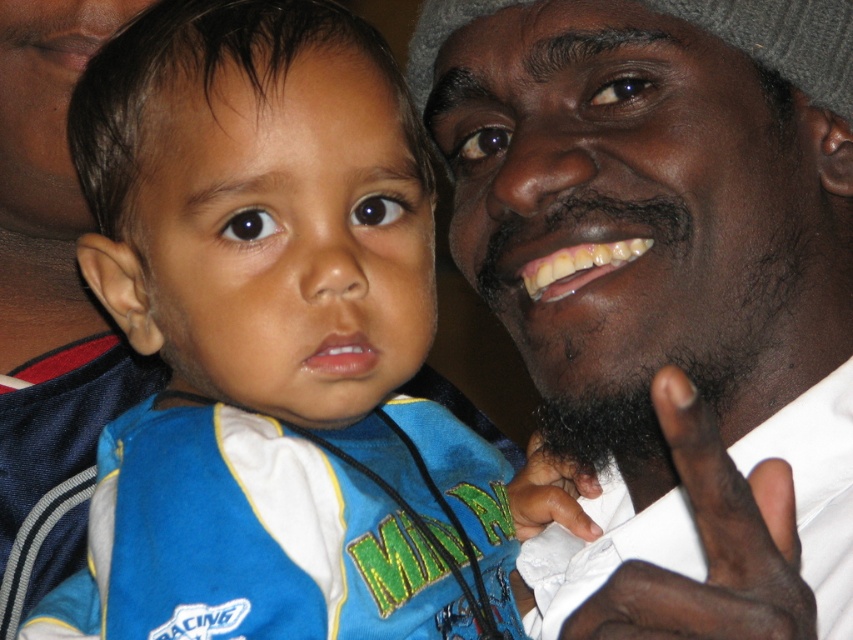
Is blue fabric shirt at center wider than dark skin textured hand at lower right?

Correct, the width of blue fabric shirt at center exceeds that of dark skin textured hand at lower right.

Is blue fabric shirt at center positioned at the back of dark skin textured hand at lower right?

Yes, it is behind dark skin textured hand at lower right.

The image size is (853, 640). Describe the element at coordinates (274, 340) in the screenshot. I see `blue fabric shirt at center` at that location.

Find the location of a particular element. This screenshot has height=640, width=853. blue fabric shirt at center is located at coordinates (274, 340).

Which of these two, dark skin textured hand at lower right or dark skin hand at lower center, stands shorter?

With less height is dark skin hand at lower center.

Can you confirm if dark skin textured hand at lower right is positioned to the right of dark skin hand at lower center?

Yes, dark skin textured hand at lower right is to the right of dark skin hand at lower center.

Who is more distant from viewer, [704,508] or [534,465]?

The point [534,465] is behind.

Locate an element on the screen. dark skin textured hand at lower right is located at coordinates (711, 545).

Is smooth skin face at upper right above dark skin textured hand at lower right?

Yes, smooth skin face at upper right is above dark skin textured hand at lower right.

Who is more forward, (607,461) or (740,529)?

Point (740,529) is in front.

Who is more distant from viewer, [689,426] or [724,536]?

Point [724,536]

You are a GUI agent. You are given a task and a screenshot of the screen. Output one action in this format:
    pyautogui.click(x=<x>, y=<y>)
    Task: Click on the smooth skin face at upper right
    Image resolution: width=853 pixels, height=640 pixels.
    Given the screenshot: What is the action you would take?
    pyautogui.click(x=666, y=291)